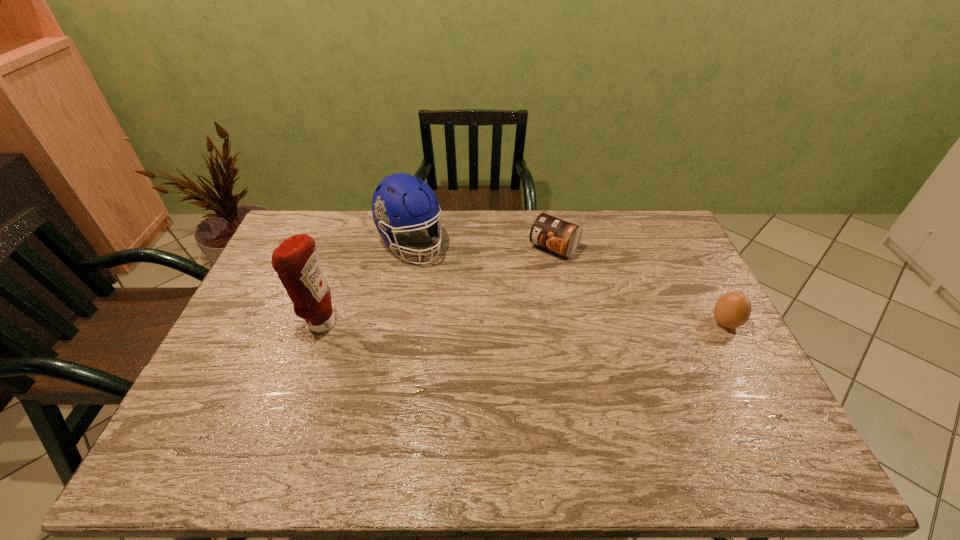
Where is `condiment`? condiment is located at coordinates (296, 261).

Where is `boiled egg`? Image resolution: width=960 pixels, height=540 pixels. boiled egg is located at coordinates (733, 309).

You are a GUI agent. You are given a task and a screenshot of the screen. Output one action in this format:
    pyautogui.click(x=<x>, y=<y>)
    Task: Click on the can
    The image size is (960, 540).
    Given the screenshot: What is the action you would take?
    pyautogui.click(x=557, y=235)

Identify the location of the second object from left to right. The width and height of the screenshot is (960, 540). (402, 195).

This screenshot has height=540, width=960. What are the coordinates of `football helmet` in the screenshot? It's located at 402,195.

Locate an element on the screen. The image size is (960, 540). vacant space situated on the right of the leftmost object is located at coordinates (396, 323).

The width and height of the screenshot is (960, 540). Identify the location of free region located 0.090m on the left of the rightmost object. (680, 323).

This screenshot has height=540, width=960. I want to click on vacant space located on the front label of the second object from right to left, so click(486, 322).

Where is `vacant area situated on the front label of the second object from right to left`? Image resolution: width=960 pixels, height=540 pixels. vacant area situated on the front label of the second object from right to left is located at coordinates (473, 335).

Where is `vacant space located on the front label of the second object from right to left`? The image size is (960, 540). vacant space located on the front label of the second object from right to left is located at coordinates (475, 333).